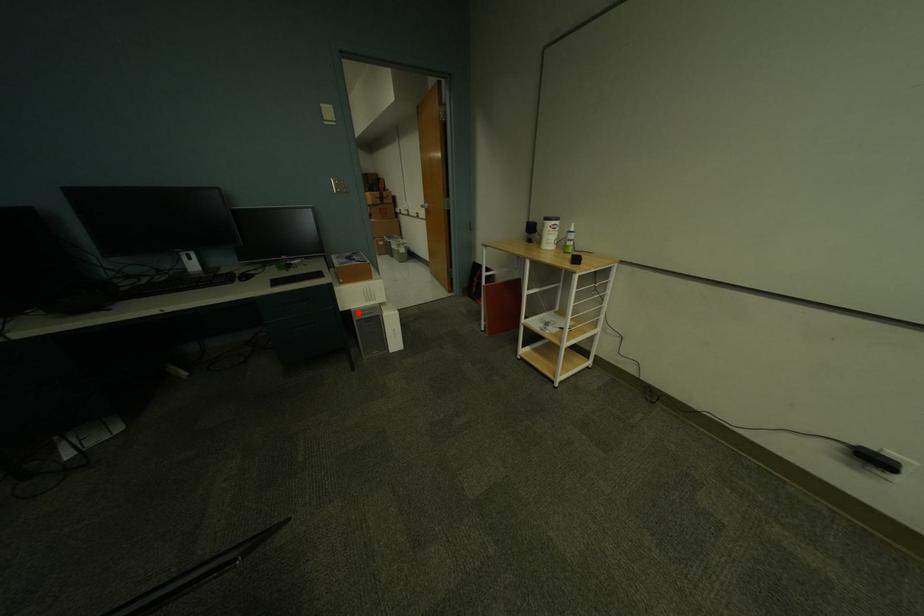
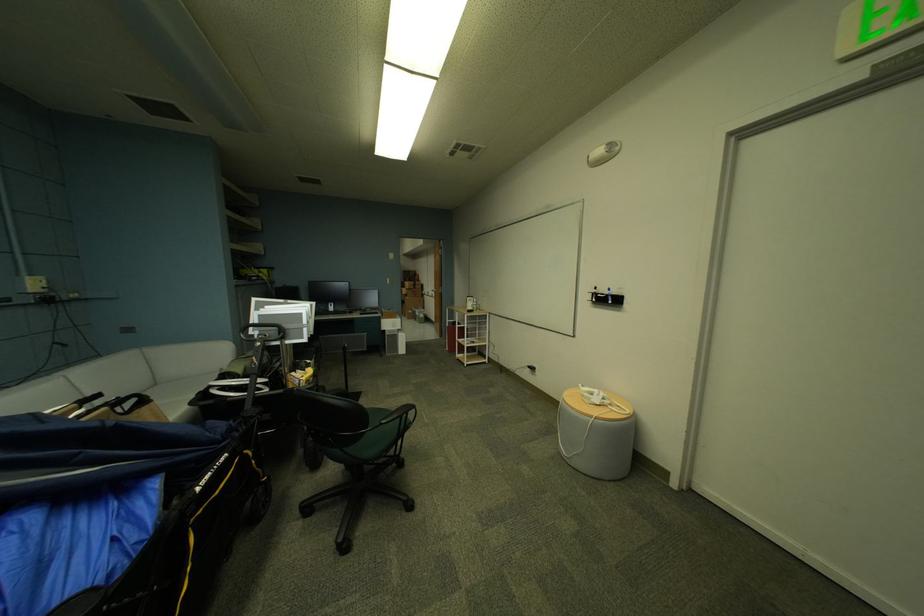
In the second image, find the point that corresponds to the highlighted location in the first image.

(393, 331)